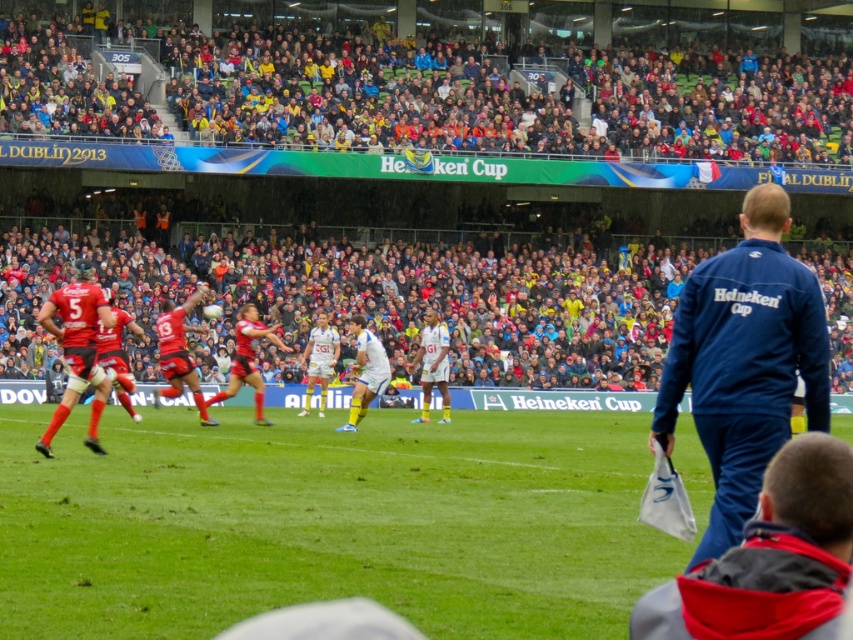
Can you confirm if blue fabric jacket at right is shorter than blue fabric jacket at lower right?

In fact, blue fabric jacket at right may be taller than blue fabric jacket at lower right.

Can you confirm if blue fabric jacket at right is thinner than blue fabric jacket at lower right?

No.

Between point (730, 301) and point (692, 570), which one is positioned behind?

Point (730, 301)

Find the location of a particular element. This screenshot has width=853, height=640. blue fabric jacket at right is located at coordinates (744, 362).

Is the position of multicolored fabric seats at upper center less distant than that of red jersey at center?

No.

Which is in front, point (515, 96) or point (73, 388)?

Point (73, 388)

Between point (602, 124) and point (210, 294), which one is positioned behind?

Positioned behind is point (602, 124).

Locate an element on the screen. The image size is (853, 640). multicolored fabric seats at upper center is located at coordinates (434, 81).

Is point (767, 344) closer to viewer compared to point (90, 282)?

That is True.

Who is more distant from viewer, (792, 349) or (259, 388)?

Positioned behind is point (259, 388).

Which is behind, point (691, 403) or point (62, 401)?

The point (62, 401) is more distant.

At what (x,y) coordinates should I click in order to perform the action: click on blue fabric jacket at right. Please return your answer as a coordinate pair (x, y). Looking at the image, I should click on (744, 362).